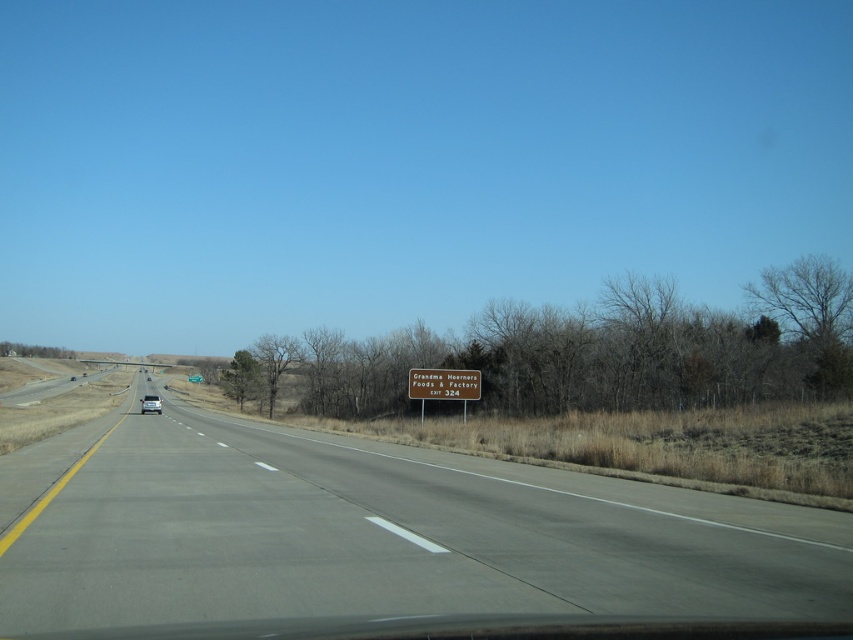
You are driving along the highway and see two points marked on your GPS. The first point is at coordinate point (x=131, y=541) and the second is at point (x=433, y=378). If you are moving forward along the highway, which point will you reach first?

Point (x=131, y=541) is in front of point (x=433, y=378), so you will reach point (x=131, y=541) first.

Based on the photo, you are driving a car and see the brown wooden sign at center and the white glossy car at center on the highway. Which object is narrower in width?

The brown wooden sign at center is thinner than the white glossy car at center, so the brown wooden sign at center is narrower in width.